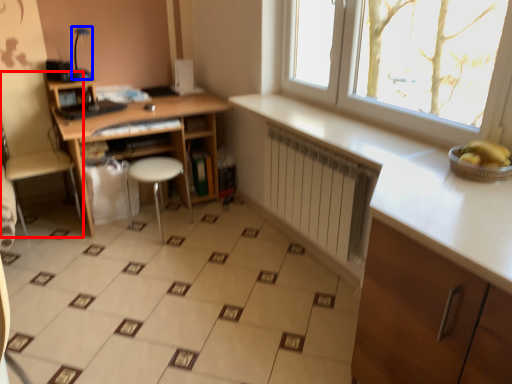
Question: Which object appears closest to the camera in this image, swivel chair (highlighted by a red box) or lamp (highlighted by a blue box)?

Choices:
 (A) swivel chair
 (B) lamp

Answer: (A)